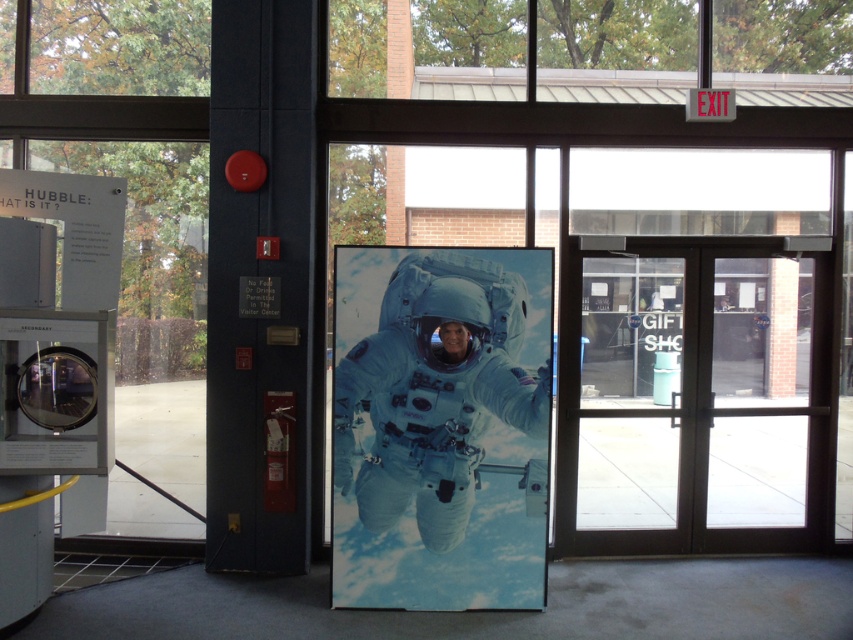
In the scene shown: You are standing in the visitor center and want to exit through the brown glass doors at center. If you are currently 20 feet away from them, can you reach the doors without moving closer?

The brown glass doors at center are 19.75 feet away from you, so you are already within reach since you are only 20 feet away. Move slightly forward to touch the doors.

You are standing inside the visitor center and want to exit through the doors. Which door should you approach first, the brown glass doors at center or the transparent glass door at center?

You should approach the brown glass doors at center first because it is closer to you than the transparent glass door at center, which is further away.